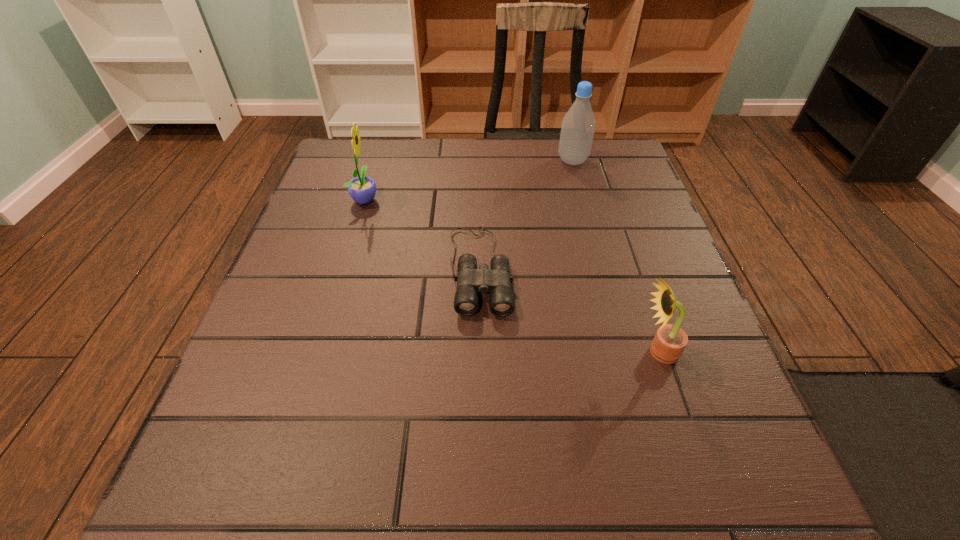
Identify the location of the farthest object. The height and width of the screenshot is (540, 960). (578, 126).

This screenshot has width=960, height=540. In order to click on the leftmost object in this screenshot , I will do `click(362, 189)`.

Where is `the third nearest object`? the third nearest object is located at coordinates (362, 189).

Where is `the nearest object`? the nearest object is located at coordinates (669, 342).

This screenshot has width=960, height=540. Identify the location of the shorter sunflower. pos(669,342).

Locate an element on the screen. Image resolution: width=960 pixels, height=540 pixels. the third object from right to left is located at coordinates (496, 281).

Find the location of a particular element. Image resolution: width=960 pixels, height=540 pixels. binoculars is located at coordinates (496, 281).

The width and height of the screenshot is (960, 540). Identify the location of free space located on the left of the farthest object. (461, 161).

You are a GUI agent. You are given a task and a screenshot of the screen. Output one action in this format:
    pyautogui.click(x=<x>, y=<y>)
    Task: Click on the blank space located 0.090m on the front-facing side of the third nearest object
    This screenshot has height=540, width=960.
    Given the screenshot: What is the action you would take?
    pyautogui.click(x=418, y=199)

This screenshot has height=540, width=960. I want to click on free region located 0.140m on the face of the shorter sunflower, so click(x=554, y=352).